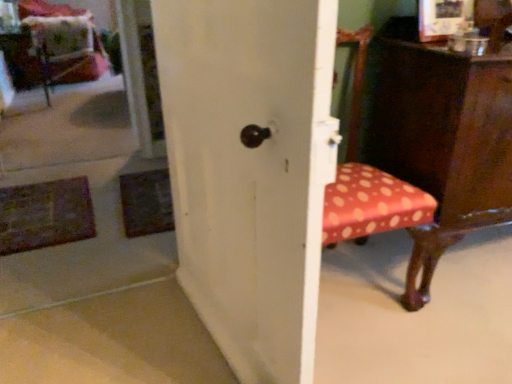
Question: From the image's perspective, is velvet polka dot swivel chair at upper left located beneath white matte door at center?

Choices:
 (A) yes
 (B) no

Answer: (B)

Question: Is velvet polka dot swivel chair at upper left outside white matte door at center?

Choices:
 (A) no
 (B) yes

Answer: (B)

Question: Considering the relative sizes of velvet polka dot swivel chair at upper left and white matte door at center in the image provided, is velvet polka dot swivel chair at upper left taller than white matte door at center?

Choices:
 (A) no
 (B) yes

Answer: (A)

Question: Is velvet polka dot swivel chair at upper left shorter than white matte door at center?

Choices:
 (A) yes
 (B) no

Answer: (A)

Question: Considering the relative sizes of velvet polka dot swivel chair at upper left and white matte door at center in the image provided, is velvet polka dot swivel chair at upper left bigger than white matte door at center?

Choices:
 (A) yes
 (B) no

Answer: (A)

Question: Does velvet polka dot swivel chair at upper left have a lesser width compared to white matte door at center?

Choices:
 (A) yes
 (B) no

Answer: (B)

Question: Is polka dot fabric chair at right located within velvet cushion at upper left?

Choices:
 (A) no
 (B) yes

Answer: (A)

Question: Is velvet cushion at upper left outside of polka dot fabric chair at right?

Choices:
 (A) yes
 (B) no

Answer: (A)

Question: Could you tell me if velvet cushion at upper left is facing polka dot fabric chair at right?

Choices:
 (A) no
 (B) yes

Answer: (A)

Question: Does velvet cushion at upper left have a smaller size compared to polka dot fabric chair at right?

Choices:
 (A) no
 (B) yes

Answer: (B)

Question: From the image's perspective, is velvet cushion at upper left below polka dot fabric chair at right?

Choices:
 (A) no
 (B) yes

Answer: (A)

Question: Considering the relative sizes of velvet cushion at upper left and polka dot fabric chair at right in the image provided, is velvet cushion at upper left bigger than polka dot fabric chair at right?

Choices:
 (A) yes
 (B) no

Answer: (B)

Question: From a real-world perspective, is velvet cushion at upper left over white matte door at center?

Choices:
 (A) yes
 (B) no

Answer: (B)